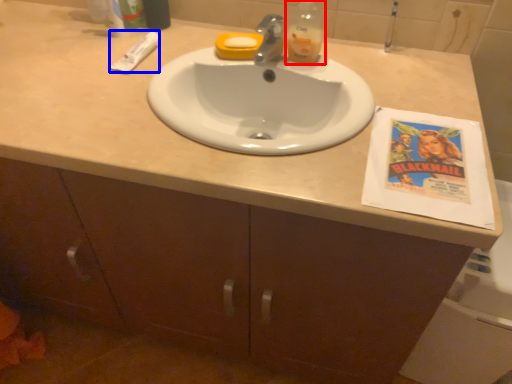
Question: Which object is closer to the camera taking this photo, bottle (highlighted by a red box) or toothpaste (highlighted by a blue box)?

Choices:
 (A) bottle
 (B) toothpaste

Answer: (A)